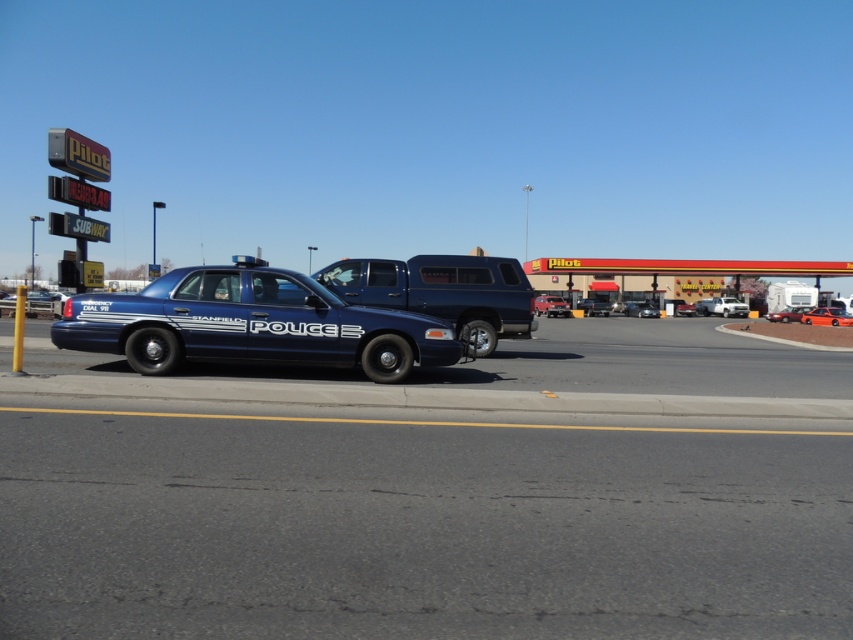
Between glossy blue pickup truck at center and red/yellow gas station at center, which one appears on the left side from the viewer's perspective?

glossy blue pickup truck at center is more to the left.

Where is `glossy blue pickup truck at center`? The image size is (853, 640). glossy blue pickup truck at center is located at coordinates (442, 292).

Is the position of orange matte sedan at center more distant than that of metallic blue sedan at center?

No, orange matte sedan at center is closer to the viewer.

Which is in front, point (822, 321) or point (552, 300)?

Point (822, 321) is more forward.

Where is `orange matte sedan at center`? orange matte sedan at center is located at coordinates (827, 316).

Is point (570, 284) positioned after point (792, 320)?

That is True.

Which of these two, red/yellow gas station at center or metallic silver sedan at center, stands shorter?

metallic silver sedan at center

Who is more forward, (657, 273) or (811, 308)?

Point (811, 308) is in front.

Identify the location of red/yellow gas station at center. The width and height of the screenshot is (853, 640). (685, 268).